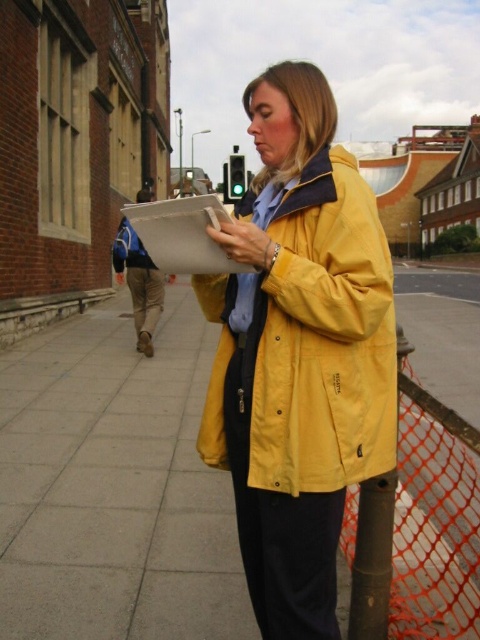
Question: Which of the following is the farthest from the observer?

Choices:
 (A) (436, 276)
 (B) (312, 333)

Answer: (A)

Question: Does yellow fabric jacket at center have a smaller size compared to yellow matte jacket at center?

Choices:
 (A) yes
 (B) no

Answer: (B)

Question: Which point is farther to the camera?

Choices:
 (A) (314, 433)
 (B) (456, 292)

Answer: (B)

Question: Observing the image, what is the correct spatial positioning of yellow fabric jacket at center in reference to yellow matte jacket at center?

Choices:
 (A) below
 (B) above

Answer: (B)

Question: Can you confirm if yellow fabric jacket at center is positioned to the left of yellow matte jacket at center?

Choices:
 (A) no
 (B) yes

Answer: (A)